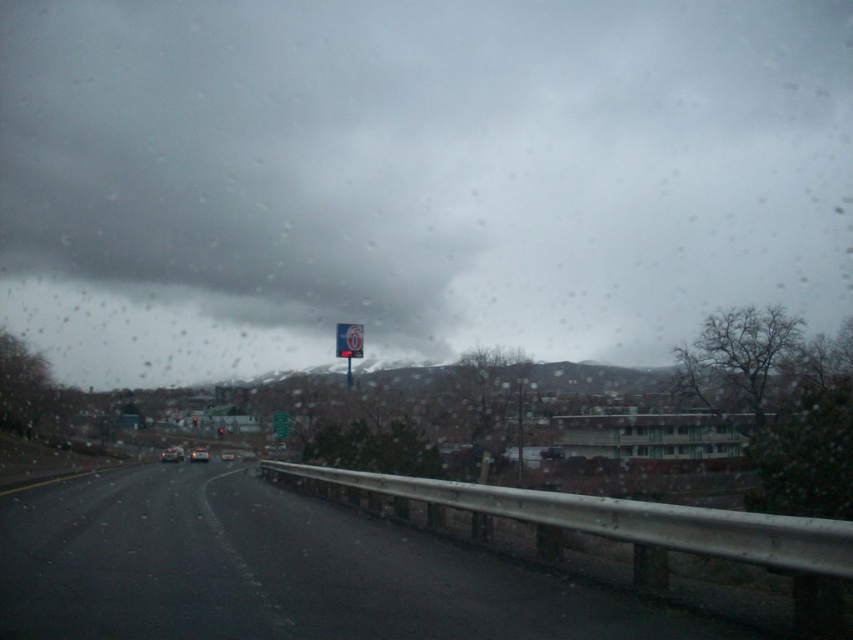
Who is more distant from viewer, (613, 112) or (274, 419)?

The point (613, 112) is more distant.

Does gray cloudy sky at upper center appear under white plastic sign at center?

Actually, gray cloudy sky at upper center is above white plastic sign at center.

Between point (100, 266) and point (280, 417), which one is positioned behind?

Point (100, 266)

The width and height of the screenshot is (853, 640). What are the coordinates of `gray cloudy sky at upper center` in the screenshot? It's located at (415, 177).

Is black asphalt highway at center positioned in front of white plastic sign at center?

Yes.

Does black asphalt highway at center appear under white plastic sign at center?

No.

Which is behind, point (213, 556) or point (271, 413)?

The point (271, 413) is more distant.

Find the location of a particular element. black asphalt highway at center is located at coordinates (276, 572).

Who is positioned more to the left, gray cloudy sky at upper center or black asphalt highway at center?

Positioned to the left is black asphalt highway at center.

Is gray cloudy sky at upper center further to the viewer compared to black asphalt highway at center?

Yes.

Is point (729, 60) positioned behind point (345, 529)?

Yes, point (729, 60) is behind point (345, 529).

Identify the location of gray cloudy sky at upper center. The width and height of the screenshot is (853, 640). (415, 177).